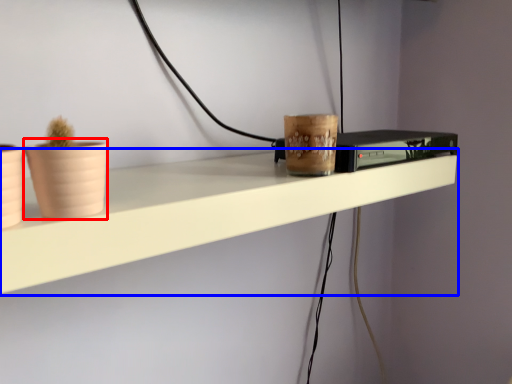
Question: Which object appears closest to the camera in this image, flowerpot (highlighted by a red box) or shelf (highlighted by a blue box)?

Choices:
 (A) flowerpot
 (B) shelf

Answer: (A)